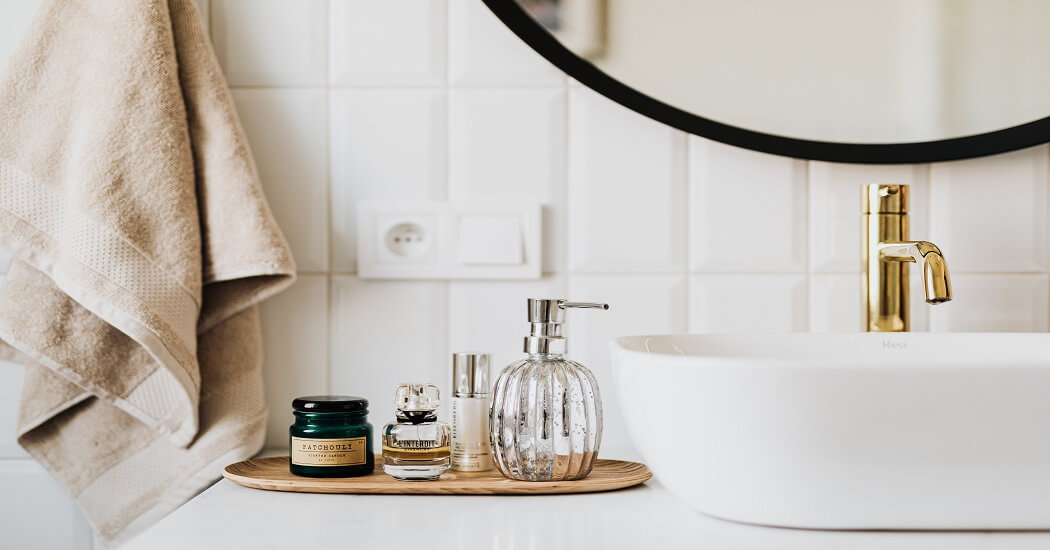
Where is `sink`? The image size is (1050, 550). sink is located at coordinates (902, 421).